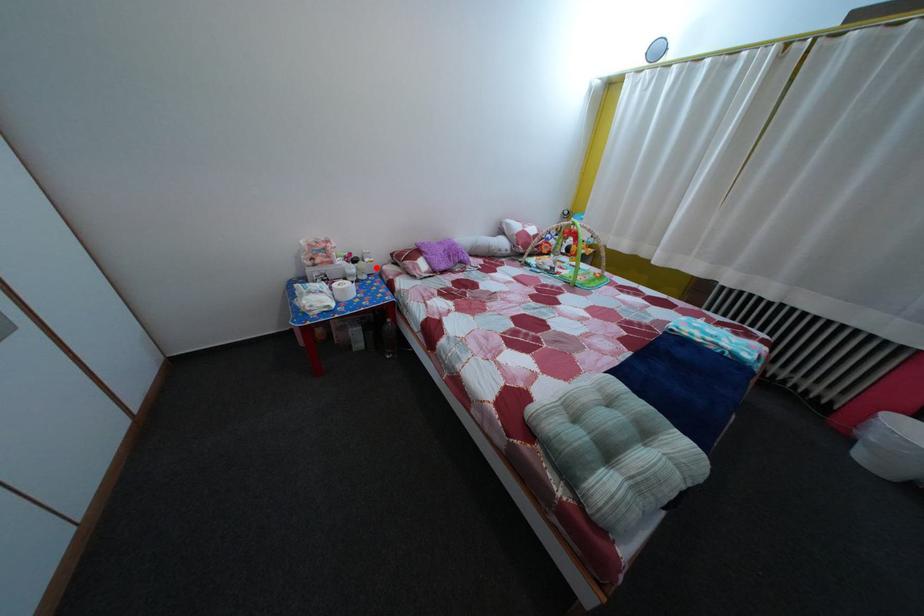
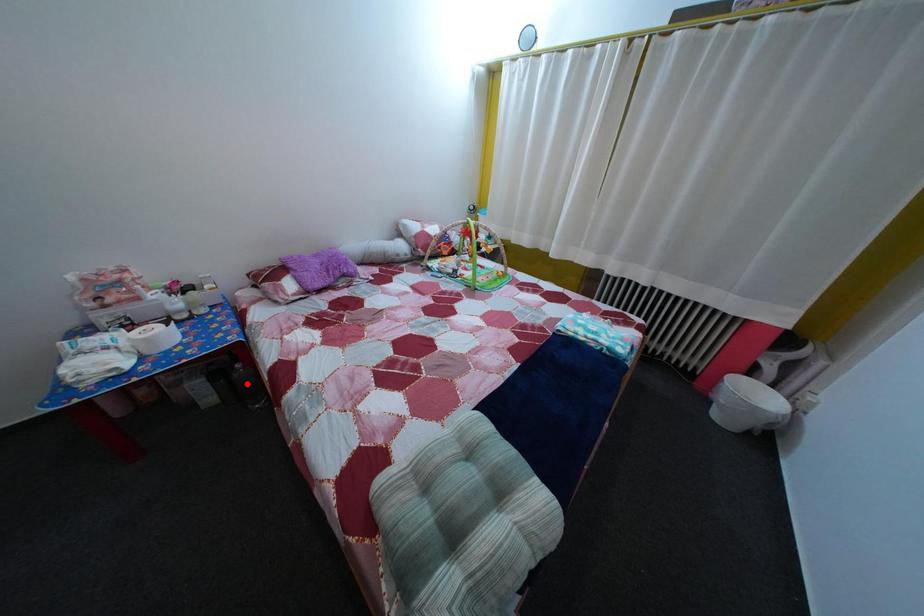
I am providing you with two images of the same scene from different viewpoints. A red point is marked on the first image and another point is marked on the second image. Are the points marked in image1 and image2 representing the same 3D position?

No